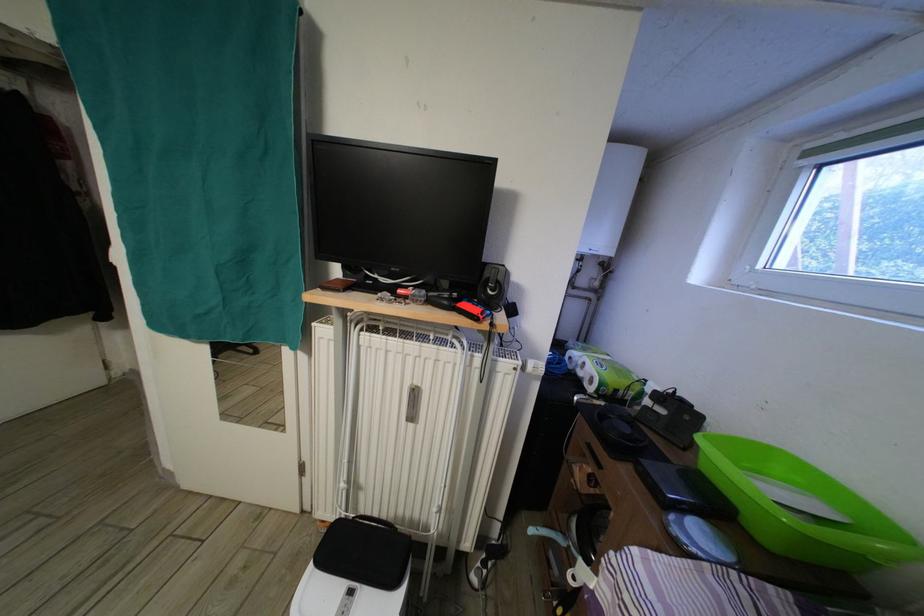
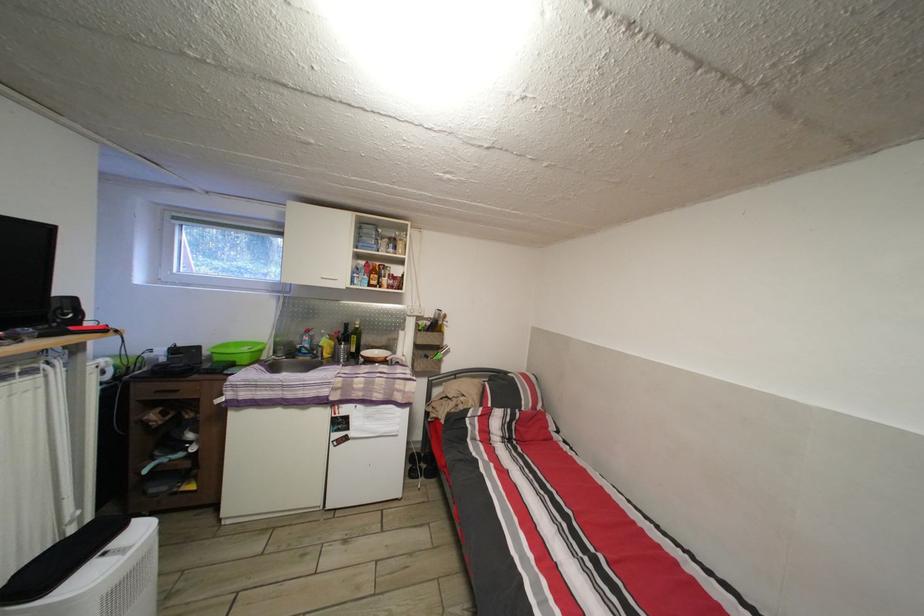
The point at (606, 472) is marked in the first image. Where is the corresponding point in the second image?

(184, 398)